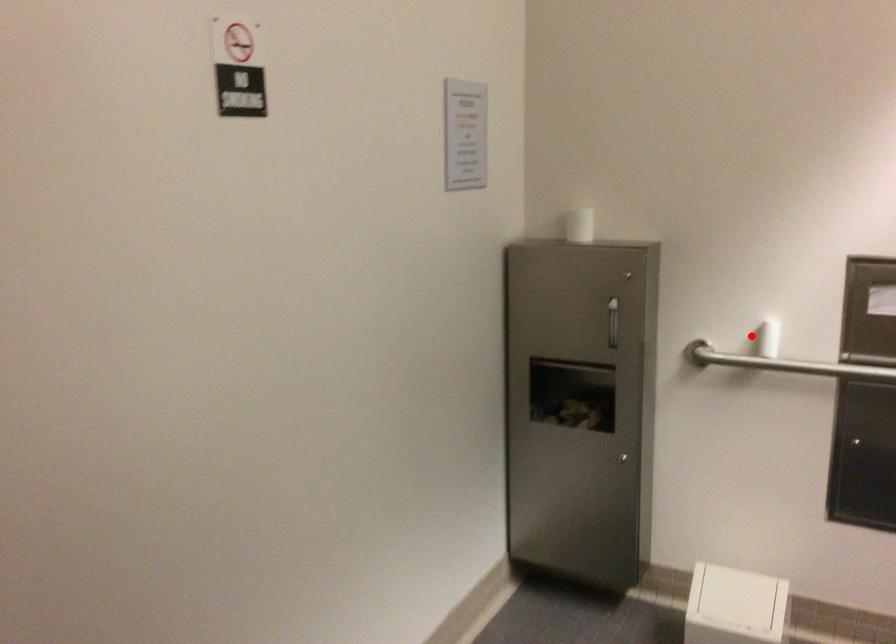
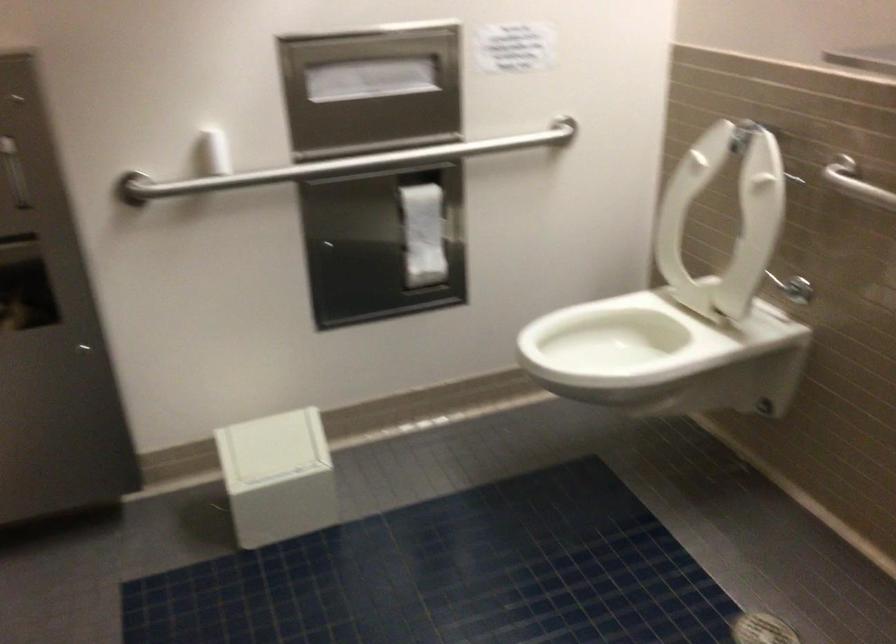
Question: I am providing you with two images of the same scene from different viewpoints. A red point is shown in image1. For the corresponding object point in image2, is it positioned nearer or farther from the camera?

Choices:
 (A) Nearer
 (B) Farther

Answer: (A)